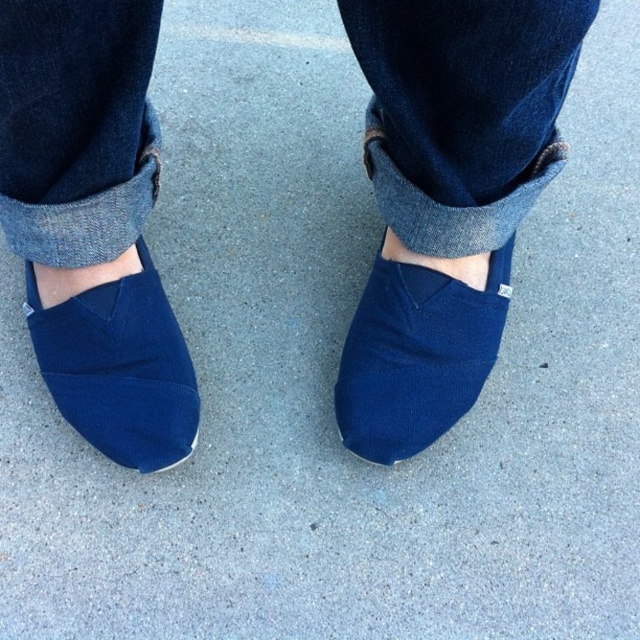
Question: Which point is closer to the camera?

Choices:
 (A) matte blue slip-on shoe at center
 (B) navy suede slip-on shoe at lower left
 (C) navy blue canvas shoes at center

Answer: (C)

Question: Can you confirm if matte blue slip-on shoe at center is positioned to the left of navy suede slip-on shoe at lower left?

Choices:
 (A) yes
 (B) no

Answer: (B)

Question: Is matte blue slip-on shoe at center to the left of navy suede slip-on shoe at lower left from the viewer's perspective?

Choices:
 (A) no
 (B) yes

Answer: (A)

Question: Which of these objects is positioned closest to the navy blue canvas shoes at center?

Choices:
 (A) navy suede slip-on shoe at lower left
 (B) matte blue slip-on shoe at center

Answer: (B)

Question: Among these points, which one is nearest to the camera?

Choices:
 (A) (481, 324)
 (B) (157, 372)

Answer: (B)

Question: Does navy blue canvas shoes at center have a greater width compared to matte blue slip-on shoe at center?

Choices:
 (A) yes
 (B) no

Answer: (A)